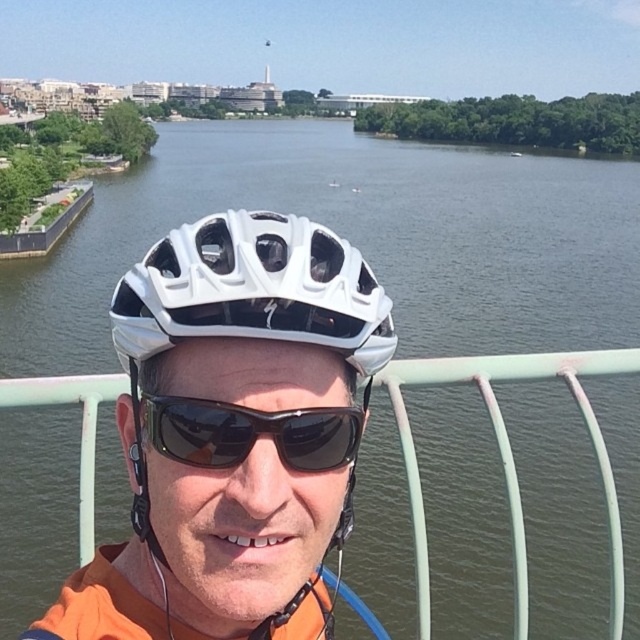
Which is more to the right, white matte helmet at center or white metal rail at center?

Positioned to the right is white metal rail at center.

Who is positioned more to the left, white matte helmet at center or white metal rail at center?

Positioned to the left is white matte helmet at center.

Is point (330, 300) behind point (92, 374)?

No, it is not.

You are a GUI agent. You are given a task and a screenshot of the screen. Output one action in this format:
    pyautogui.click(x=<x>, y=<y>)
    Task: Click on the white matte helmet at center
    This screenshot has height=640, width=640.
    Given the screenshot: What is the action you would take?
    pyautogui.click(x=232, y=429)

In the scene shown: Who is more distant from viewer, (420,579) or (348,435)?

The point (420,579) is more distant.

Is white metal rail at center closer to the viewer compared to black matte sunglasses at center?

That is False.

Between point (541, 368) and point (173, 448), which one is positioned behind?

The point (541, 368) is more distant.

Identify the location of white metal rail at center. The height and width of the screenshot is (640, 640). (508, 452).

Is white matte helmet at center wider than black matte sunglasses at center?

Yes.

Does white matte helmet at center have a smaller size compared to black matte sunglasses at center?

No.

Image resolution: width=640 pixels, height=640 pixels. In order to click on white matte helmet at center in this screenshot , I will do [x=232, y=429].